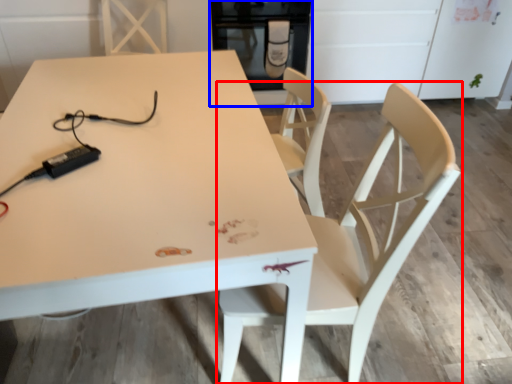
Question: Which of the following is the farthest to the observer, chair (highlighted by a red box) or appliance (highlighted by a blue box)?

Choices:
 (A) chair
 (B) appliance

Answer: (B)